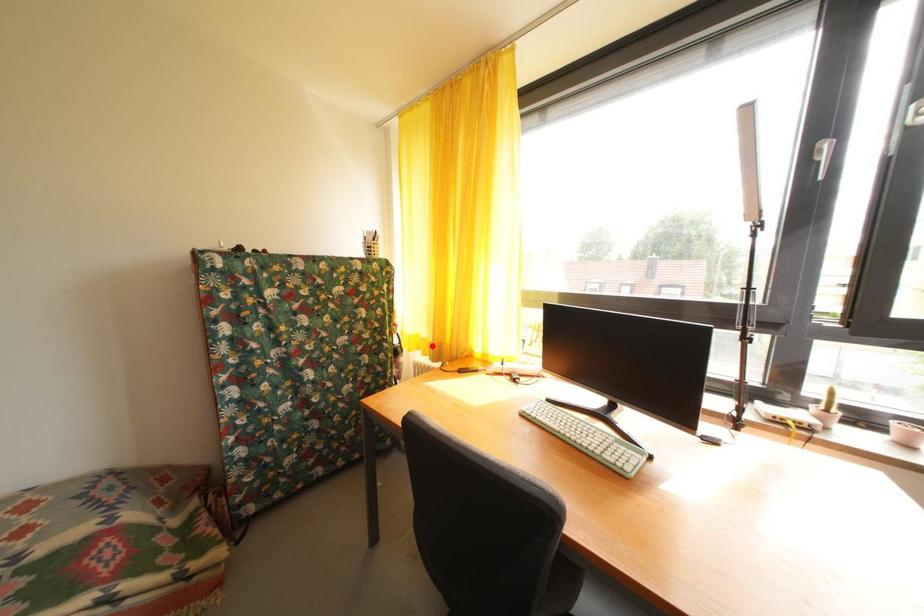
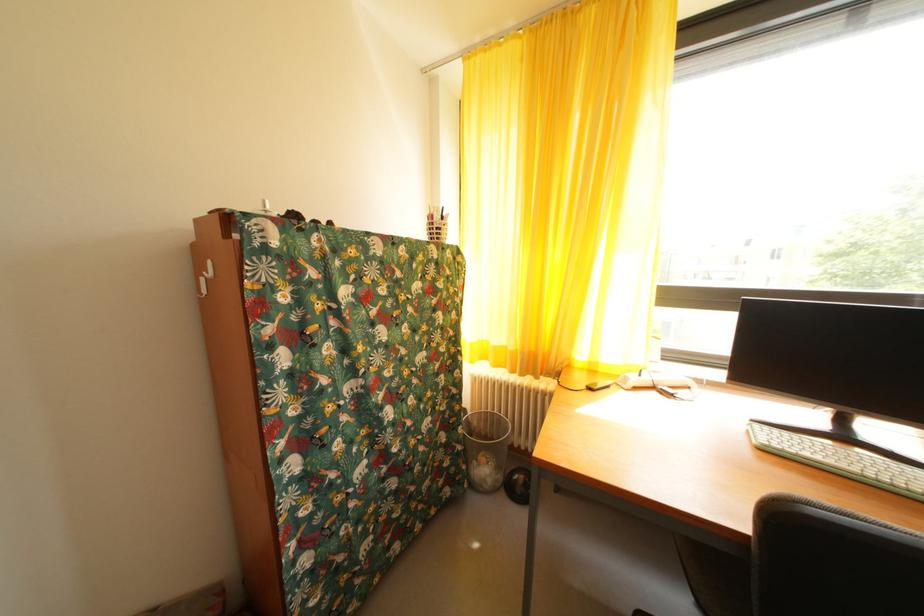
Find the pixel in the second image that matches the highlighted location in the first image.

(505, 354)